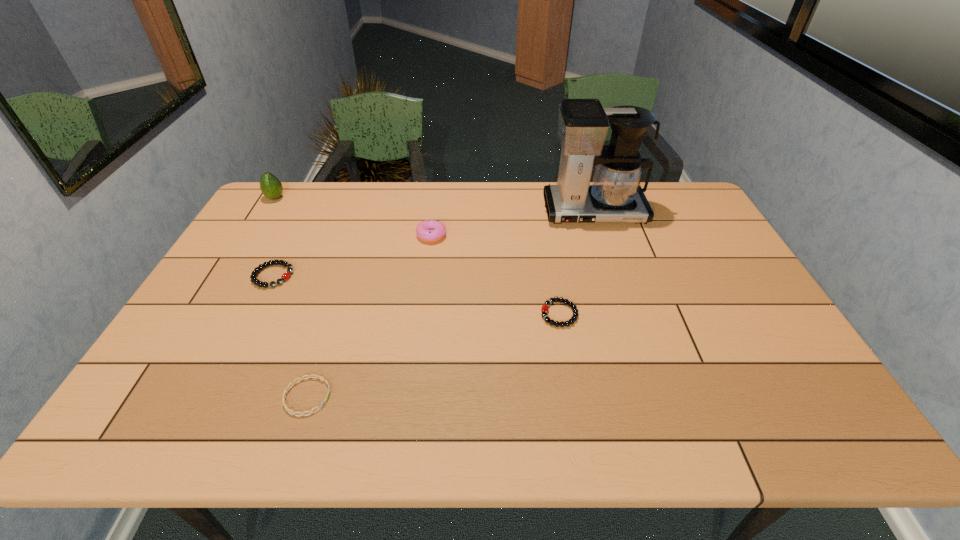
Locate an element on the screen. The image size is (960, 540). coffee maker is located at coordinates (615, 196).

What are the coordinates of `avocado` in the screenshot? It's located at (271, 187).

Find the location of `the leftmost object`. the leftmost object is located at coordinates (271, 187).

Find the location of `the fourth object from left to right`. the fourth object from left to right is located at coordinates (428, 230).

The image size is (960, 540). Find the location of `doughnut`. doughnut is located at coordinates (428, 230).

You are a GUI agent. You are given a task and a screenshot of the screen. Output one action in this format:
    pyautogui.click(x=<x>, y=<y>)
    Task: Click on the leftmost bracelet
    This screenshot has height=540, width=960.
    Given the screenshot: What is the action you would take?
    pyautogui.click(x=286, y=275)

Where is `the farthest bracelet`? This screenshot has width=960, height=540. the farthest bracelet is located at coordinates (286, 275).

The width and height of the screenshot is (960, 540). What are the coordinates of `the second nearest object` in the screenshot? It's located at (545, 308).

Find the location of a particular element. the second farthest bracelet is located at coordinates (545, 308).

Where is `the second bracelet from right to left`? The height and width of the screenshot is (540, 960). the second bracelet from right to left is located at coordinates (309, 376).